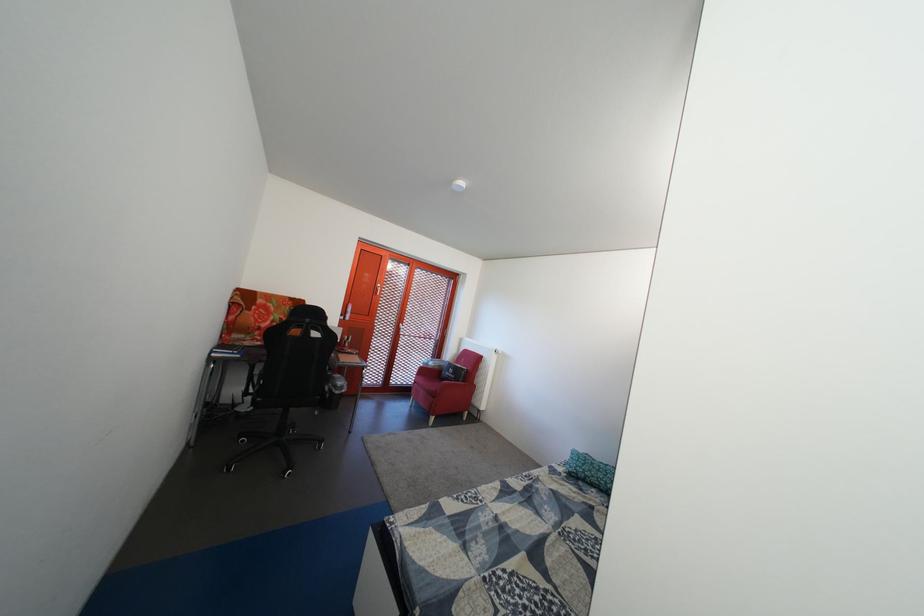
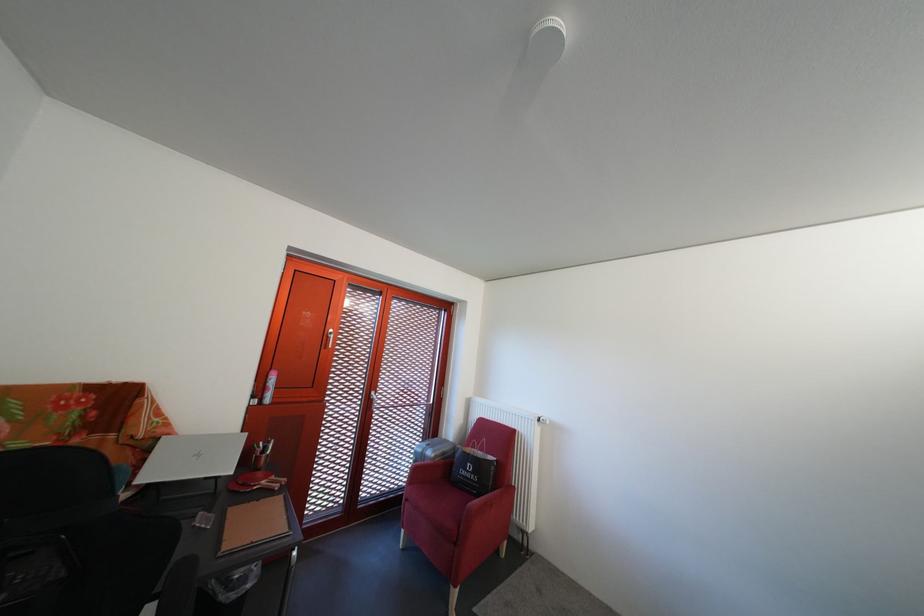
Where in the second image is the point corresponding to point (426, 389) from the first image?

(418, 507)